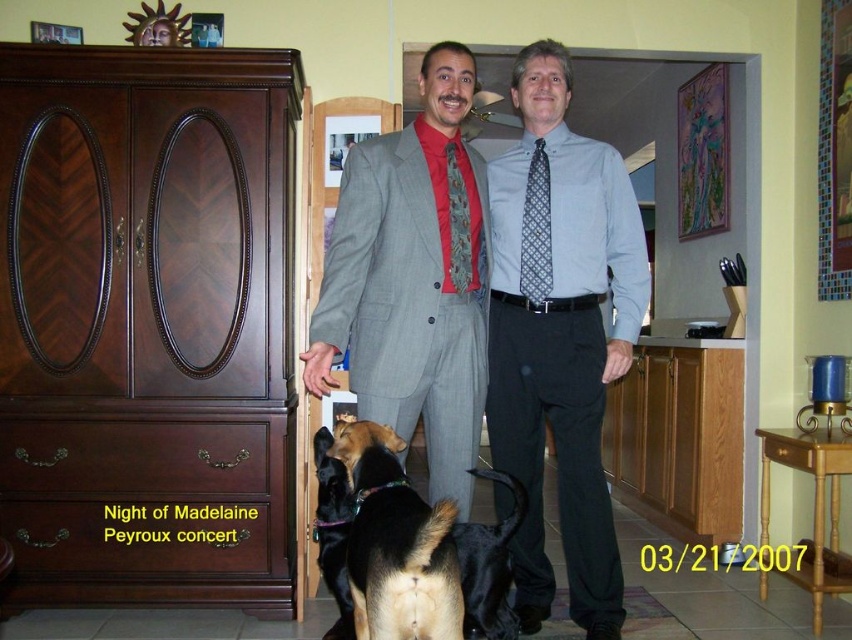
Who is more distant from viewer, (50, 177) or (528, 285)?

Point (50, 177)

Can you confirm if dark wood armoire at left is positioned above blue patterned tie at center?

Actually, dark wood armoire at left is below blue patterned tie at center.

I want to click on dark wood armoire at left, so click(x=147, y=323).

Image resolution: width=852 pixels, height=640 pixels. What are the coordinates of `dark wood armoire at left` in the screenshot? It's located at (147, 323).

Can you confirm if black fur dog at center is shorter than red silk tie at center?

In fact, black fur dog at center may be taller than red silk tie at center.

Can you confirm if black fur dog at center is taller than red silk tie at center?

Yes, black fur dog at center is taller than red silk tie at center.

This screenshot has width=852, height=640. Identify the location of black fur dog at center. (332, 531).

Is light blue shirt at center closer to camera compared to brown fur dog at center?

No, light blue shirt at center is further to the viewer.

From the picture: Between light blue shirt at center and brown fur dog at center, which one has less height?

With less height is brown fur dog at center.

Is point (510, 432) in front of point (393, 515)?

No, (510, 432) is further to viewer.

The image size is (852, 640). I want to click on light blue shirt at center, so click(x=560, y=336).